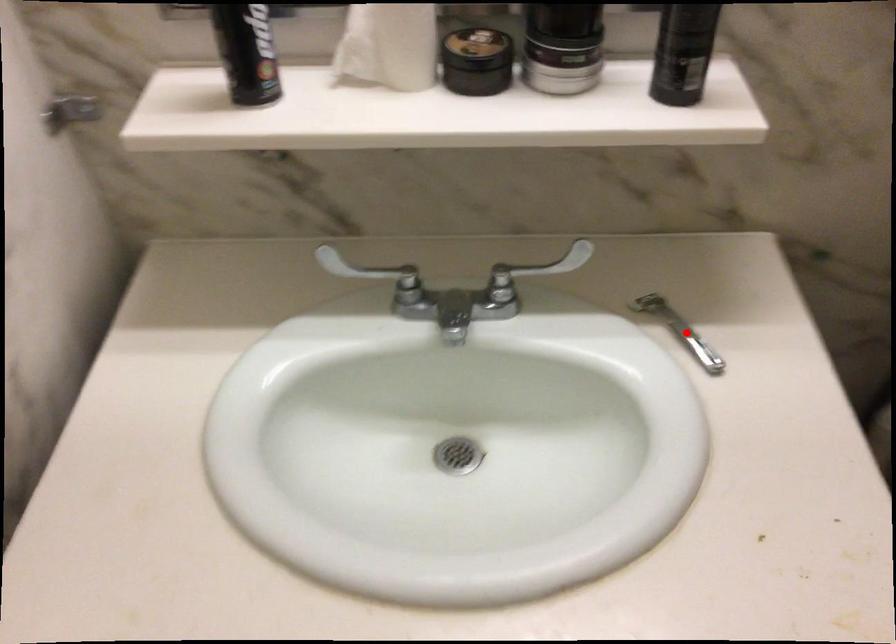
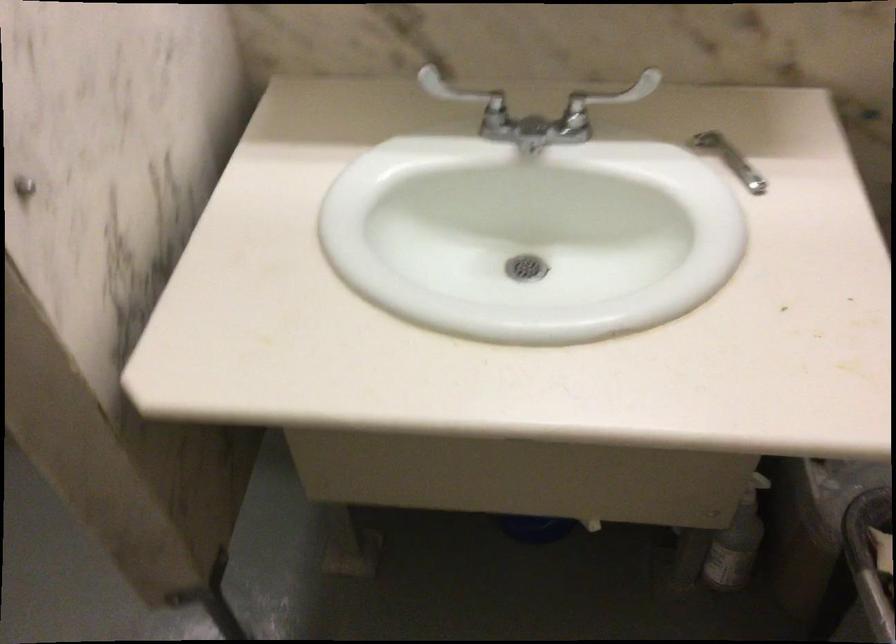
Question: I am providing you with two images of the same scene from different viewpoints. Given a red point in image1, look at the same physical point in image2. Is it:

Choices:
 (A) Closer to the viewpoint
 (B) Farther from the viewpoint

Answer: (B)